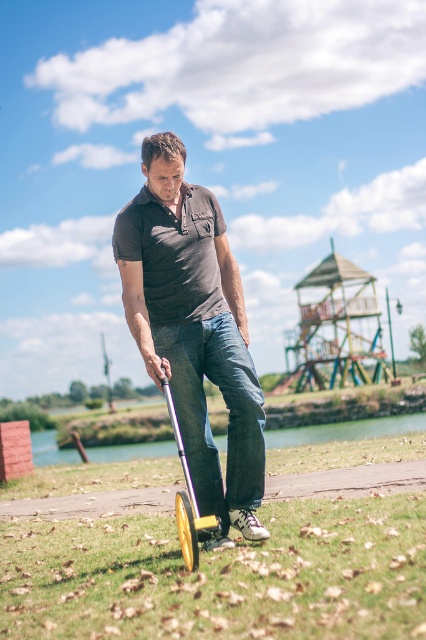
Is green grass at lower center to the right of yellow rubber scooter at lower center from the viewer's perspective?

Correct, you'll find green grass at lower center to the right of yellow rubber scooter at lower center.

The height and width of the screenshot is (640, 426). What do you see at coordinates (221, 576) in the screenshot?
I see `green grass at lower center` at bounding box center [221, 576].

What are the coordinates of `green grass at lower center` in the screenshot? It's located at (221, 576).

Between matte black shirt at center and yellow rubber scooter at lower center, which one appears on the right side from the viewer's perspective?

matte black shirt at center

Does matte black shirt at center have a larger size compared to yellow rubber scooter at lower center?

Yes.

Find the location of a particular element. The image size is (426, 640). matte black shirt at center is located at coordinates (193, 330).

This screenshot has height=640, width=426. Describe the element at coordinates (221, 576) in the screenshot. I see `green grass at lower center` at that location.

Is green grass at lower center below matte black shirt at center?

Yes, green grass at lower center is below matte black shirt at center.

Where is `green grass at lower center`? This screenshot has width=426, height=640. green grass at lower center is located at coordinates (221, 576).

At what (x,y) coordinates should I click in order to perform the action: click on green grass at lower center. Please return your answer as a coordinate pair (x, y). The width and height of the screenshot is (426, 640). Looking at the image, I should click on (221, 576).